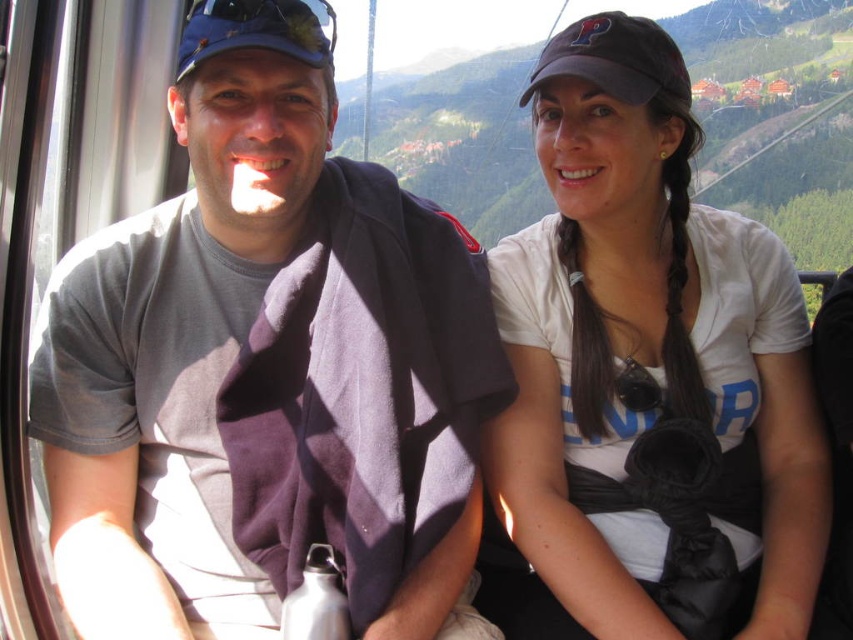
You are designing a new clothing line and want to create a matching set using the white matte shirt at center and the dark gray fabric baseball cap at upper right. Given their sizes, which item should you recommend as the primary focus for the set?

The white matte shirt at center should be the primary focus since its width is larger than the dark gray fabric baseball cap at upper right, making it the more prominent piece in the set.